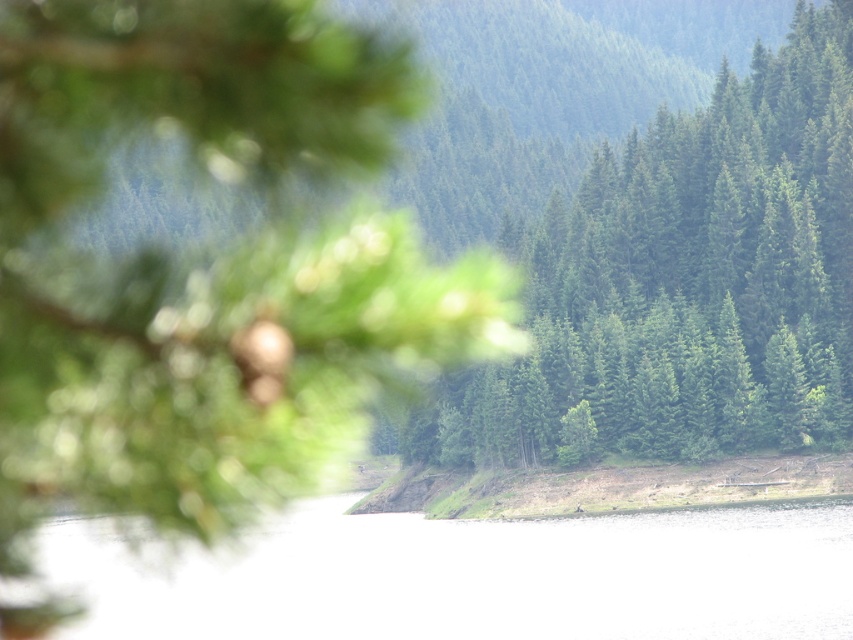
Looking at this image, you are a photographer standing in the forest and see the green matte tree at center and the clear water at center. Which object would appear closer to you if you move forward by 10 meters?

The green matte tree at center would appear closer because it is larger in size than the clear water at center, indicating it is nearer to the photographer.

You are a photographer standing at the center of the forest. You want to capture a photo of the green matte tree at center. According to the coordinates provided, where should you aim your camera to ensure the tree is in the frame?

You should aim your camera at point 0.442 on the x axis and 0.803 on the y axis to capture the green matte tree at center in the frame.

You are standing in the forest and want to take a photo of both point (459, 433) and point (416, 612). Which point is closer to your camera lens?

Point (416, 612) is closer to the camera lens because it is less further than point (459, 433).